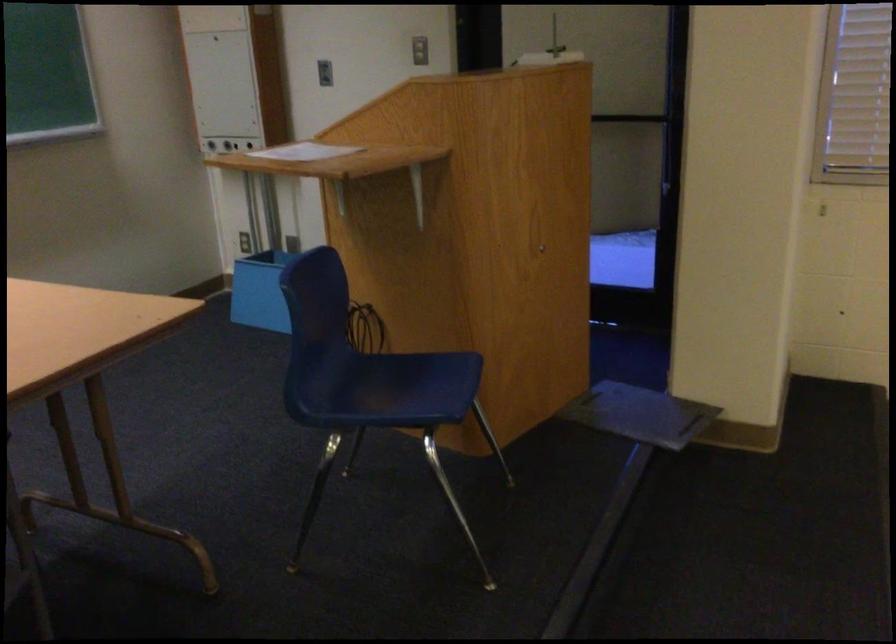
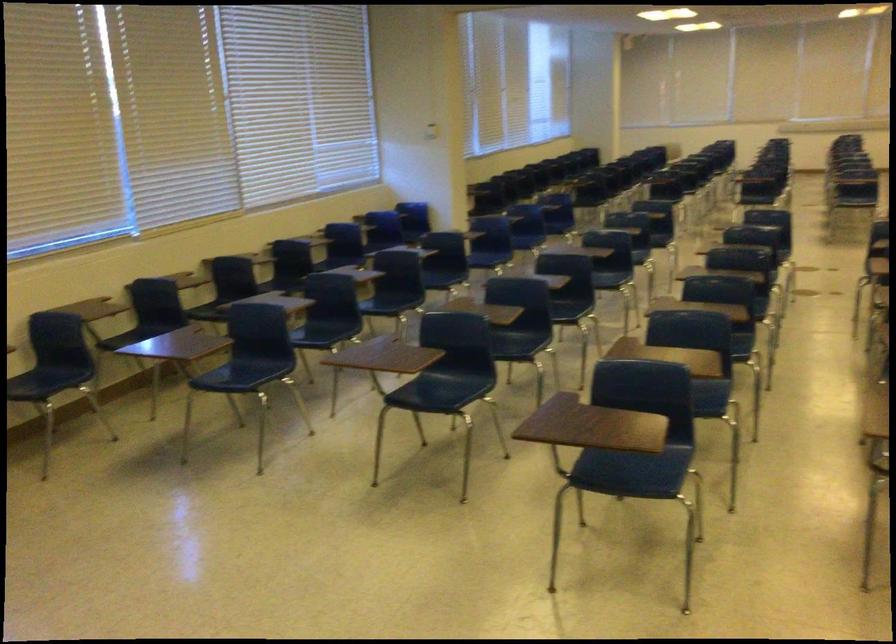
Question: The images are taken continuously from a first-person perspective. In which direction is your viewpoint rotating?

Choices:
 (A) Left
 (B) Right
 (C) Up
 (D) Down

Answer: (B)